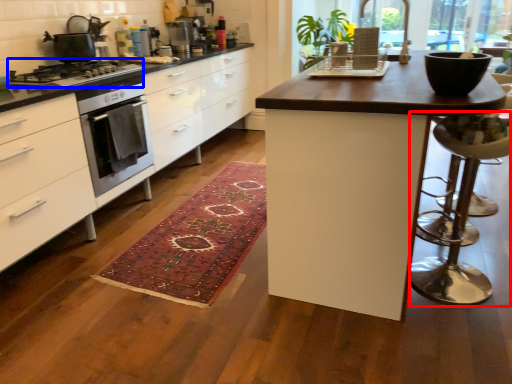
Question: Which object appears closest to the camera in this image, bar stool (highlighted by a red box) or gas stove (highlighted by a blue box)?

Choices:
 (A) bar stool
 (B) gas stove

Answer: (A)